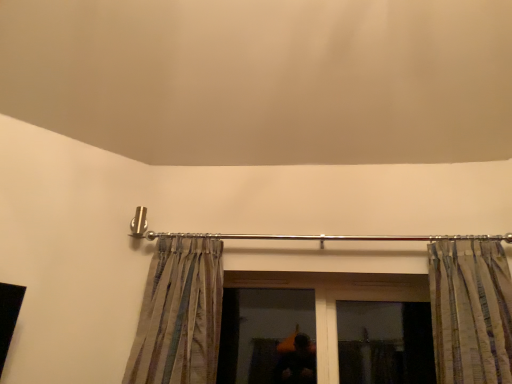
Question: Does silky striped curtain at left, the first curtain in the left-to-right sequence, have a larger size compared to striped fabric curtain at upper right, the 1th curtain positioned from the right?

Choices:
 (A) no
 (B) yes

Answer: (B)

Question: Would you say silky striped curtain at left, which is the 2th curtain from right to left, is a long distance from striped fabric curtain at upper right, the 1th curtain positioned from the right?

Choices:
 (A) no
 (B) yes

Answer: (B)

Question: Is silky striped curtain at left, which is the 2th curtain from right to left, aimed at striped fabric curtain at upper right, the 1th curtain positioned from the right?

Choices:
 (A) yes
 (B) no

Answer: (B)

Question: Is silky striped curtain at left, the first curtain in the left-to-right sequence, surrounding striped fabric curtain at upper right, which ranks as the second curtain in left-to-right order?

Choices:
 (A) yes
 (B) no

Answer: (B)

Question: From a real-world perspective, is silky striped curtain at left, the first curtain in the left-to-right sequence, located higher than striped fabric curtain at upper right, the 1th curtain positioned from the right?

Choices:
 (A) yes
 (B) no

Answer: (B)

Question: Is the position of silky striped curtain at left, which is the 2th curtain from right to left, less distant than that of striped fabric curtain at upper right, the 1th curtain positioned from the right?

Choices:
 (A) yes
 (B) no

Answer: (B)

Question: Is the depth of silky striped curtain at left, which is the 2th curtain from right to left, greater than that of transparent glass window at center?

Choices:
 (A) no
 (B) yes

Answer: (A)

Question: Considering the relative sizes of silky striped curtain at left, which is the 2th curtain from right to left, and transparent glass window at center in the image provided, is silky striped curtain at left, which is the 2th curtain from right to left, smaller than transparent glass window at center?

Choices:
 (A) yes
 (B) no

Answer: (B)

Question: From the image's perspective, does silky striped curtain at left, the first curtain in the left-to-right sequence, appear higher than transparent glass window at center?

Choices:
 (A) no
 (B) yes

Answer: (B)

Question: Does silky striped curtain at left, which is the 2th curtain from right to left, appear on the right side of transparent glass window at center?

Choices:
 (A) yes
 (B) no

Answer: (B)

Question: Can you confirm if silky striped curtain at left, the first curtain in the left-to-right sequence, is wider than transparent glass window at center?

Choices:
 (A) no
 (B) yes

Answer: (B)

Question: Are silky striped curtain at left, which is the 2th curtain from right to left, and transparent glass window at center beside each other?

Choices:
 (A) no
 (B) yes

Answer: (A)

Question: Are transparent glass window at center and silky striped curtain at left, which is the 2th curtain from right to left, making contact?

Choices:
 (A) no
 (B) yes

Answer: (A)